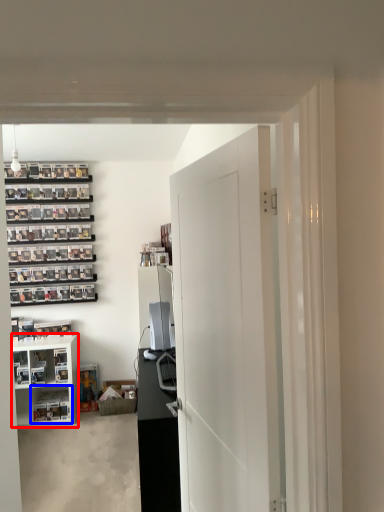
Question: Which object is closer to the camera taking this photo, cabinetry (highlighted by a red box) or shelf (highlighted by a blue box)?

Choices:
 (A) cabinetry
 (B) shelf

Answer: (A)